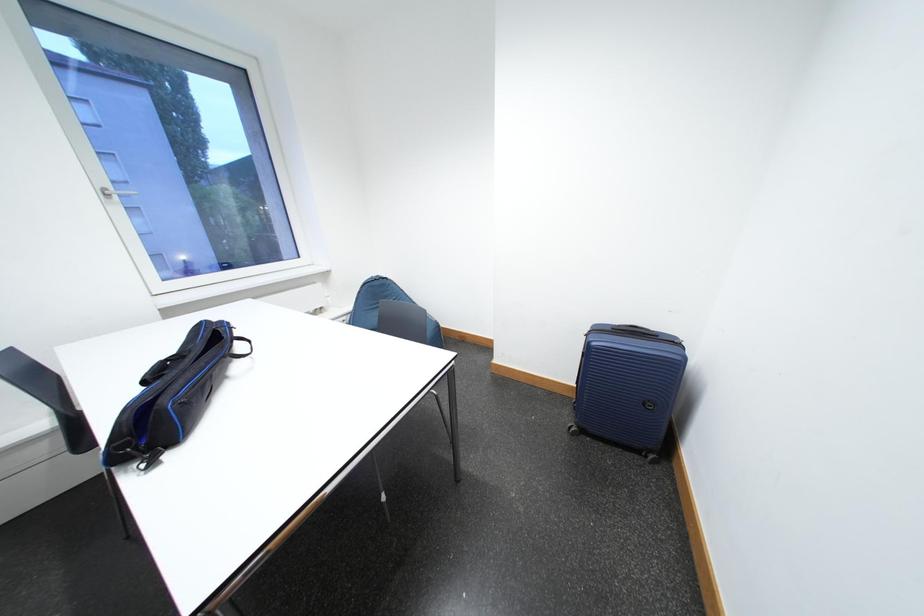
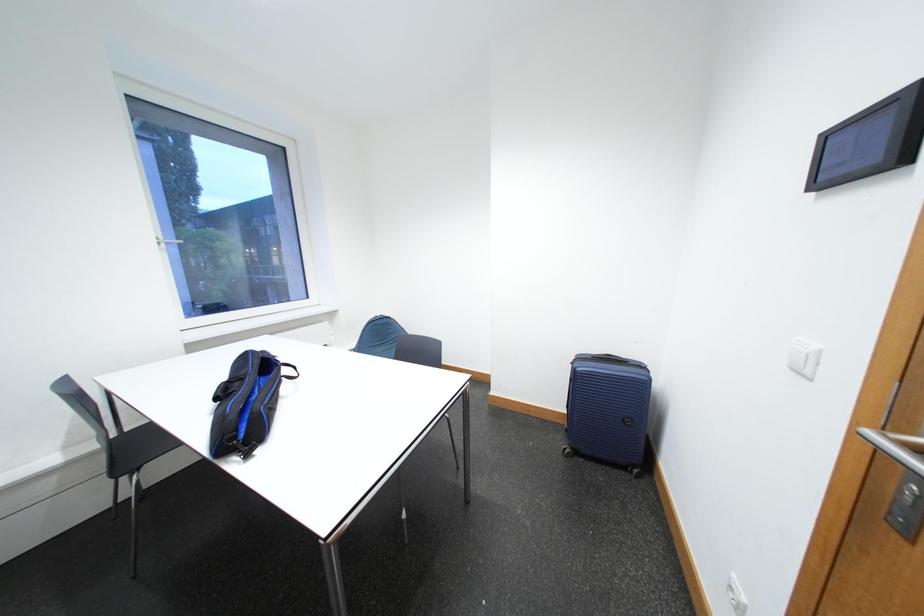
Question: How did the camera likely rotate?

Choices:
 (A) Left
 (B) Right
 (C) Up
 (D) Down

Answer: (C)